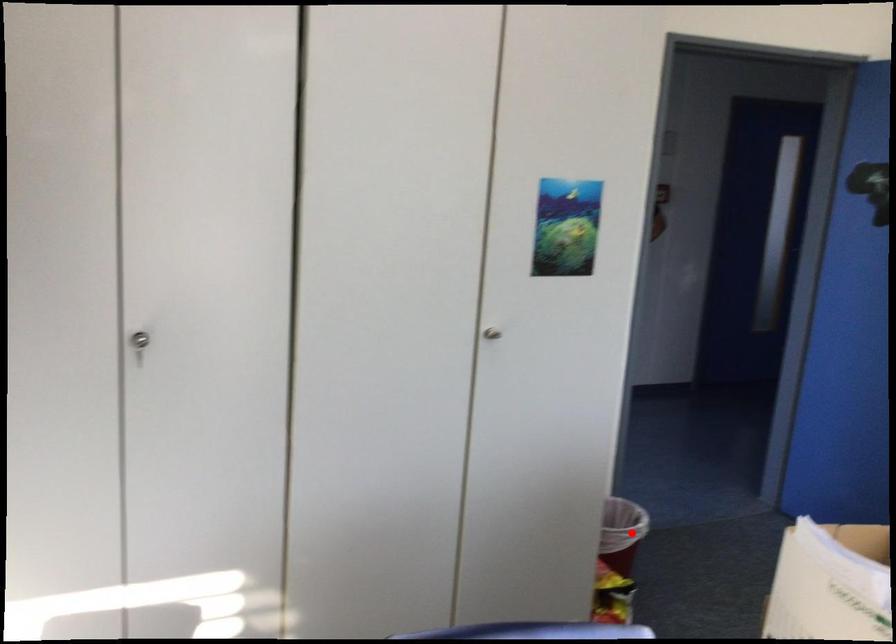
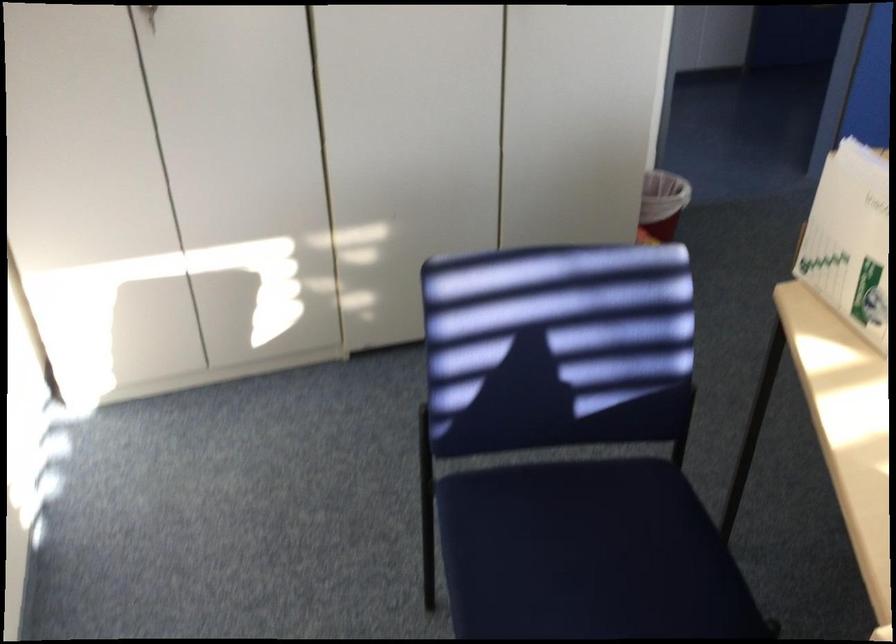
Question: I am providing you with two images of the same scene from different viewpoints. A red point is marked on the first image. At the location where the point appears in image 1, is it still visible in image 2?

Choices:
 (A) Yes
 (B) No

Answer: (A)